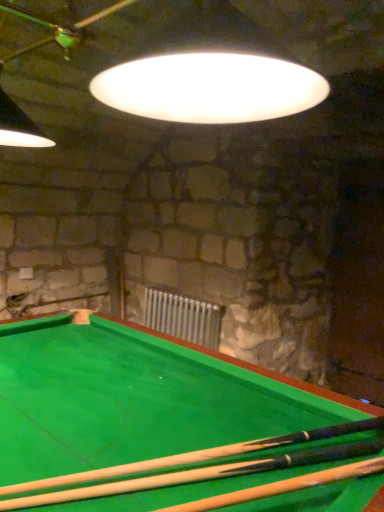
The image size is (384, 512). Describe the element at coordinates (183, 317) in the screenshot. I see `metallic silver radiator at center` at that location.

Locate an element on the screen. This screenshot has height=512, width=384. metallic silver radiator at center is located at coordinates (183, 317).

What do you see at coordinates (190, 476) in the screenshot? This screenshot has height=512, width=384. I see `wooden cue at bottom` at bounding box center [190, 476].

This screenshot has width=384, height=512. Find the location of `wooden cue at bottom`. wooden cue at bottom is located at coordinates (190, 476).

Where is `metallic silver radiator at center`? Image resolution: width=384 pixels, height=512 pixels. metallic silver radiator at center is located at coordinates (183, 317).

Which object is positioned more to the left, metallic silver radiator at center or wooden cue at bottom?

Positioned to the left is metallic silver radiator at center.

Considering the relative positions of metallic silver radiator at center and wooden cue at bottom in the image provided, is metallic silver radiator at center in front of wooden cue at bottom?

No, it is behind wooden cue at bottom.

Is point (177, 300) positioned in front of point (12, 504)?

That is False.

Looking at this image, from the image's perspective, is metallic silver radiator at center above or below wooden cue at bottom?

Based on their image positions, metallic silver radiator at center is located beneath wooden cue at bottom.

From a real-world perspective, is metallic silver radiator at center over wooden cue at bottom?

No.

Considering the relative sizes of metallic silver radiator at center and wooden cue at bottom in the image provided, is metallic silver radiator at center thinner than wooden cue at bottom?

Yes.

From the picture: From their relative heights in the image, would you say metallic silver radiator at center is taller or shorter than wooden cue at bottom?

Clearly, metallic silver radiator at center is taller compared to wooden cue at bottom.

In terms of size, does metallic silver radiator at center appear bigger or smaller than wooden cue at bottom?

Clearly, metallic silver radiator at center is larger in size than wooden cue at bottom.

Which is correct: metallic silver radiator at center is inside wooden cue at bottom, or outside of it?

metallic silver radiator at center cannot be found inside wooden cue at bottom.

Is metallic silver radiator at center placed right next to wooden cue at bottom?

They are not placed beside each other.

Consider the image. Is metallic silver radiator at center positioned with its back to wooden cue at bottom?

That's not correct — metallic silver radiator at center is not looking away from wooden cue at bottom.

How many degrees apart are the facing directions of metallic silver radiator at center and wooden cue at bottom?

30.6 degrees separate the facing orientations of metallic silver radiator at center and wooden cue at bottom.

Locate an element on the screen. cue located above the metallic silver radiator at center (from the image's perspective) is located at coordinates (190, 476).

Based on their positions, is wooden cue at bottom located to the left or right of metallic silver radiator at center?

In the image, wooden cue at bottom appears on the right side of metallic silver radiator at center.

Which object is more forward, wooden cue at bottom or metallic silver radiator at center?

wooden cue at bottom is more forward.

Is point (81, 487) farther from viewer compared to point (158, 297)?

No, it is in front of (158, 297).

From the image's perspective, which one is positioned higher, wooden cue at bottom or metallic silver radiator at center?

wooden cue at bottom appears higher in the image.

From a real-world perspective, is wooden cue at bottom located beneath metallic silver radiator at center?

No.

Between wooden cue at bottom and metallic silver radiator at center, which one has larger width?

Wider between the two is wooden cue at bottom.

Can you confirm if wooden cue at bottom is taller than metallic silver radiator at center?

Incorrect, the height of wooden cue at bottom is not larger of that of metallic silver radiator at center.

Is wooden cue at bottom bigger than metallic silver radiator at center?

Actually, wooden cue at bottom might be smaller than metallic silver radiator at center.

From the picture: Would you say wooden cue at bottom is inside or outside metallic silver radiator at center?

wooden cue at bottom cannot be found inside metallic silver radiator at center.

Looking at this image, is wooden cue at bottom far away from metallic silver radiator at center?

Yes.

Is wooden cue at bottom turned away from metallic silver radiator at center?

No.

What's the angular difference between wooden cue at bottom and metallic silver radiator at center's facing directions?

30.6 degrees.

Measure the distance from wooden cue at bottom to metallic silver radiator at center.

wooden cue at bottom is 2.31 meters away from metallic silver radiator at center.

Find the location of `radiator on the left of wooden cue at bottom`. radiator on the left of wooden cue at bottom is located at coordinates (183, 317).

Locate an element on the screen. This screenshot has height=512, width=384. radiator below the wooden cue at bottom (from the image's perspective) is located at coordinates (183, 317).

Where is `cue located above the metallic silver radiator at center (from a real-world perspective)`? cue located above the metallic silver radiator at center (from a real-world perspective) is located at coordinates point(190,476).